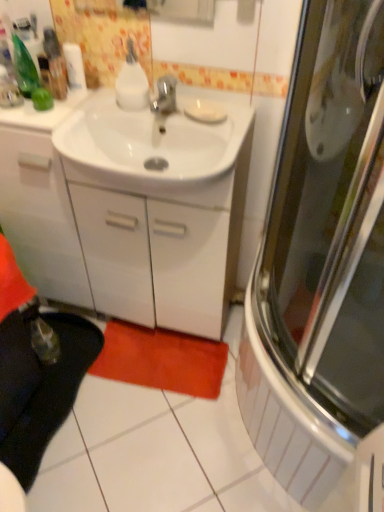
You are a GUI agent. You are given a task and a screenshot of the screen. Output one action in this format:
    pyautogui.click(x=<x>, y=<y>)
    Task: Click on the blank space situated above orange plush bath mat at lower center (from a real-world perspective)
    The width and height of the screenshot is (384, 512).
    Given the screenshot: What is the action you would take?
    pyautogui.click(x=166, y=353)